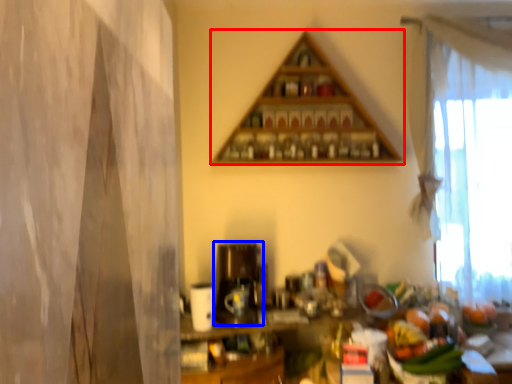
Question: Among these objects, which one is nearest to the camera, shelf (highlighted by a red box) or appliance (highlighted by a blue box)?

Choices:
 (A) shelf
 (B) appliance

Answer: (B)